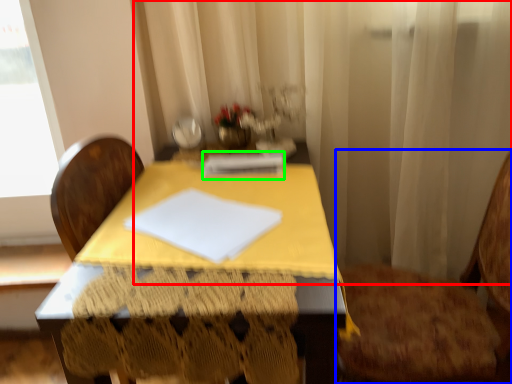
Question: Which object is positioned closest to curtain (highlighted by a red box)? Select from chair (highlighted by a blue box) and notebook (highlighted by a green box).

Choices:
 (A) chair
 (B) notebook

Answer: (A)